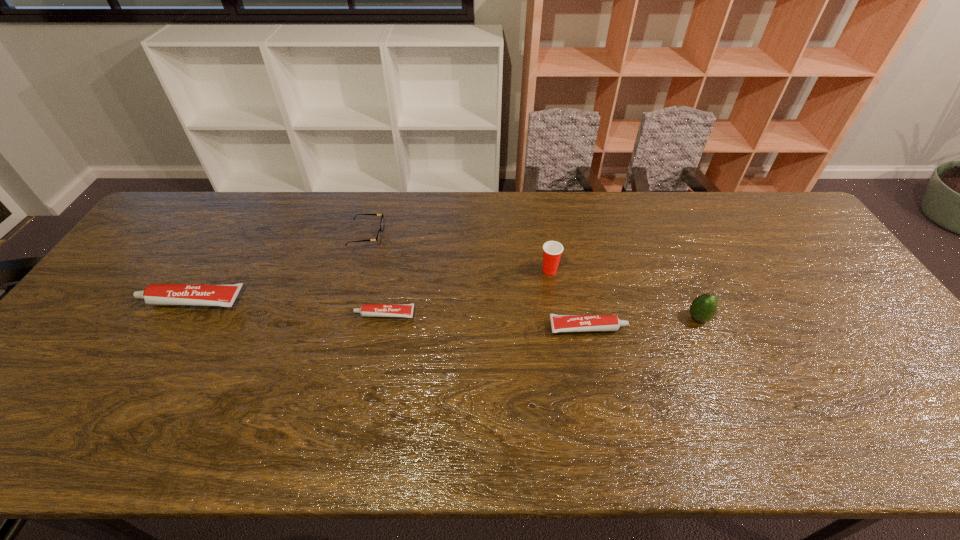
I want to click on the leftmost toothpaste, so click(x=224, y=295).

Locate an element on the screen. This screenshot has height=540, width=960. the tallest toothpaste is located at coordinates (224, 295).

The height and width of the screenshot is (540, 960). In order to click on the shortest toothpaste in this screenshot , I will do `click(366, 310)`.

Where is `the shortest object`? the shortest object is located at coordinates (366, 310).

The image size is (960, 540). Find the location of `the second shortest toothpaste`. the second shortest toothpaste is located at coordinates (560, 323).

The image size is (960, 540). What are the coordinates of `spectacles` in the screenshot? It's located at (378, 238).

This screenshot has width=960, height=540. I want to click on avocado, so click(703, 308).

Where is `the fifth nearest object`? the fifth nearest object is located at coordinates (552, 250).

This screenshot has width=960, height=540. Find the location of `vacant area situated 0.050m at the nozzle of the leftmost toothpaste`. vacant area situated 0.050m at the nozzle of the leftmost toothpaste is located at coordinates (122, 301).

You are a GUI agent. You are given a task and a screenshot of the screen. Output one action in this format:
    pyautogui.click(x=<x>, y=<y>)
    Task: Click on the blank space located at the nozzle of the shortest object
    
    Given the screenshot: What is the action you would take?
    pyautogui.click(x=284, y=314)